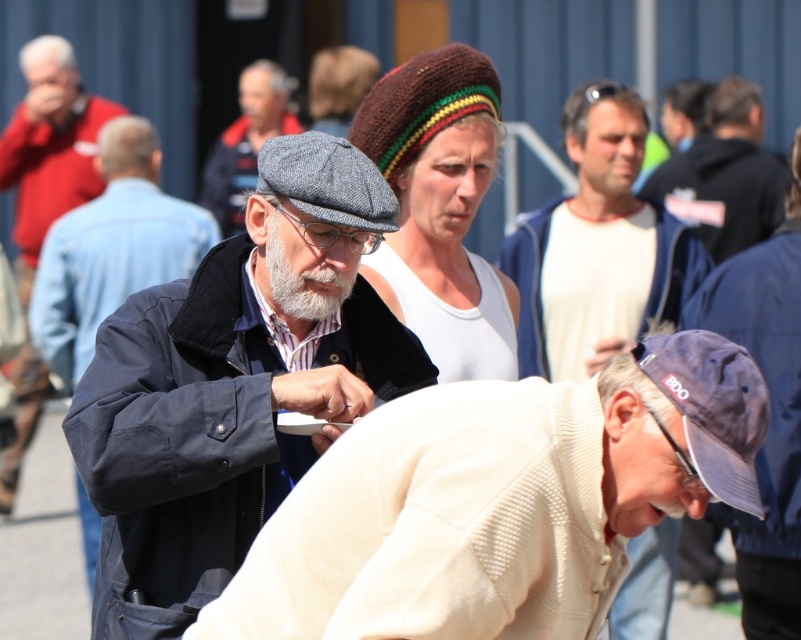
Consider the image. You are a photographer at the event and want to capture both the navy corduroy jacket at center and the knitted woolen hat at center in a single photo. The camera you have can only focus on objects within a 5 feet range. Can you fit both items in the frame without moving the camera?

The navy corduroy jacket at center and knitted woolen hat at center are 6.19 feet apart from each other, which exceeds the camera focus range of 5 feet. Therefore, you cannot fit both items in the frame without moving the camera.